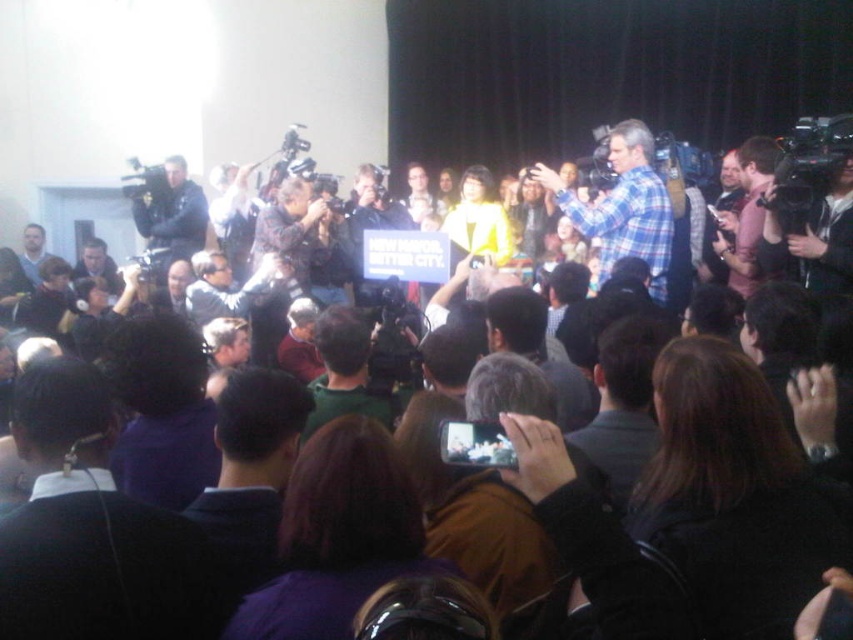
Question: Which of these objects is positioned closest to the matte black headphones at left?

Choices:
 (A) yellow fabric jacket at center
 (B) purple fabric at lower left
 (C) dark brown hair at center
 (D) brown hair at center

Answer: (A)

Question: Among these objects, which one is farthest from the camera?

Choices:
 (A) purple fabric at center
 (B) brown hair at center

Answer: (A)

Question: Can you confirm if dark brown hair at center is smaller than purple fabric at lower left?

Choices:
 (A) no
 (B) yes

Answer: (A)

Question: Can you confirm if brown hair at center is smaller than matte black headphones at left?

Choices:
 (A) no
 (B) yes

Answer: (B)

Question: From the image, what is the correct spatial relationship of brown hair at center in relation to green fabric shirt at center?

Choices:
 (A) right
 (B) left

Answer: (A)

Question: Estimate the real-world distances between objects in this image. Which object is closer to the purple fabric at center?

Choices:
 (A) dark brown hair at center
 (B) matte black headphones at left
 (C) yellow fabric jacket at center
 (D) green fabric shirt at center

Answer: (D)